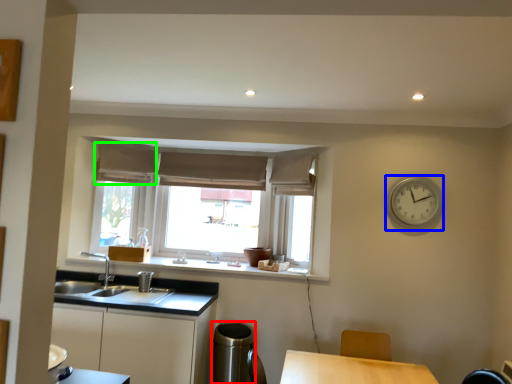
Question: Which is farther away from appliance (highlighted by a red box)? clock (highlighted by a blue box) or curtain (highlighted by a green box)?

Choices:
 (A) clock
 (B) curtain

Answer: (B)